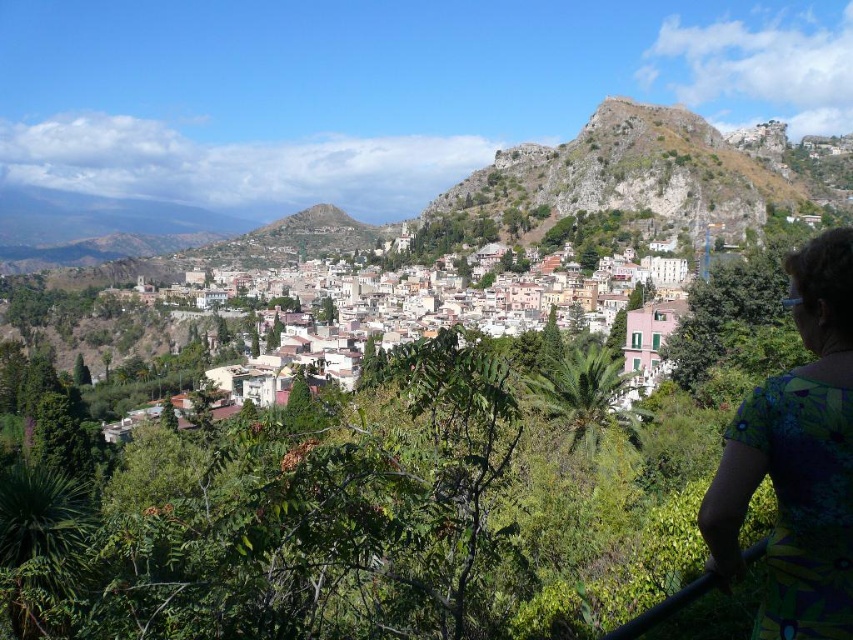
Is green floral dress at lower right above rugged stone hillside at upper right?

Actually, green floral dress at lower right is below rugged stone hillside at upper right.

Does green floral dress at lower right have a lesser height compared to rugged stone hillside at upper right?

Indeed, green floral dress at lower right has a lesser height compared to rugged stone hillside at upper right.

Describe the element at coordinates (798, 460) in the screenshot. I see `green floral dress at lower right` at that location.

You are a GUI agent. You are given a task and a screenshot of the screen. Output one action in this format:
    pyautogui.click(x=<x>, y=<y>)
    Task: Click on the green floral dress at lower right
    
    Given the screenshot: What is the action you would take?
    pyautogui.click(x=798, y=460)

Does white matte buildings at center appear under rugged stone hillside at upper right?

Yes.

Consider the image. Which is below, white matte buildings at center or rugged stone hillside at upper right?

white matte buildings at center is below.

Which is behind, point (515, 284) or point (560, 173)?

Positioned behind is point (560, 173).

You are a GUI agent. You are given a task and a screenshot of the screen. Output one action in this format:
    pyautogui.click(x=<x>, y=<y>)
    Task: Click on the white matte buildings at center
    
    Given the screenshot: What is the action you would take?
    pyautogui.click(x=454, y=323)

Between point (775, 564) and point (566, 305), which one is positioned behind?

Point (566, 305)

Is point (805, 298) in front of point (483, 252)?

Yes, point (805, 298) is closer to viewer.

Identify the location of green floral dress at lower right. This screenshot has width=853, height=640. (798, 460).